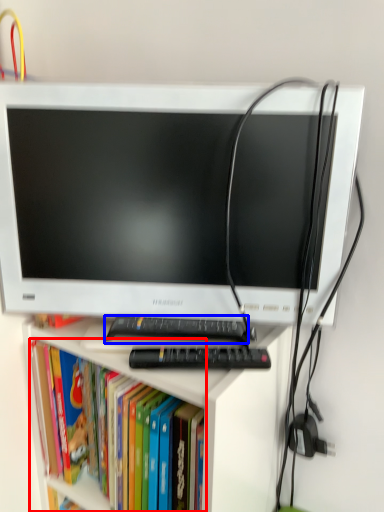
Question: Which object appears farthest to the camera in this image, book (highlighted by a red box) or keyboard (highlighted by a blue box)?

Choices:
 (A) book
 (B) keyboard

Answer: (B)